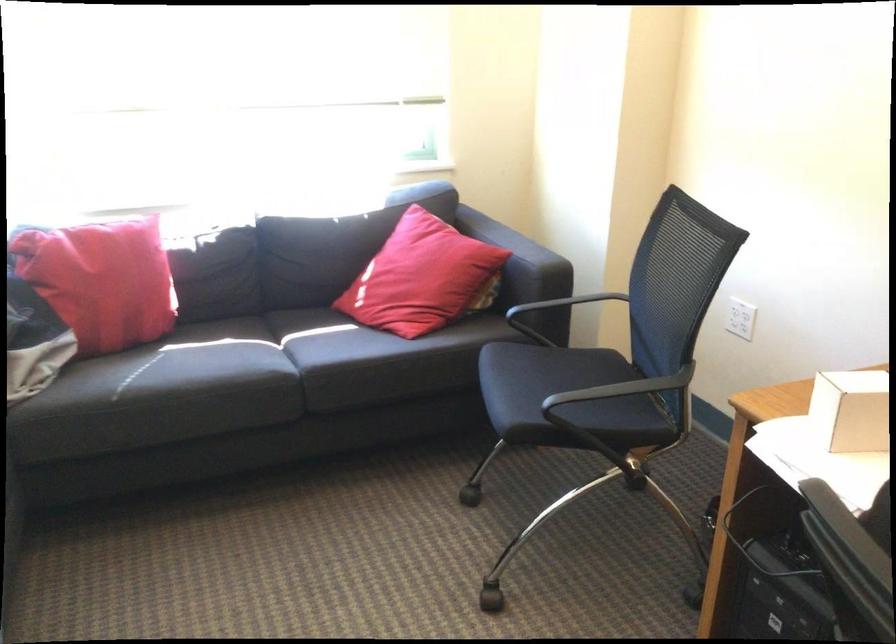
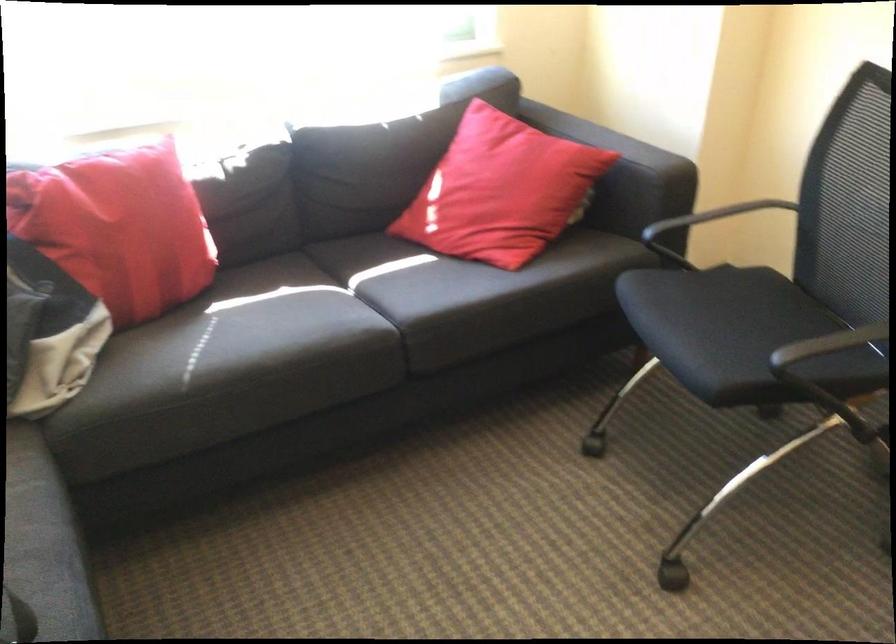
Locate, in the second image, the point that corresponds to (x=195, y=377) in the first image.

(280, 346)